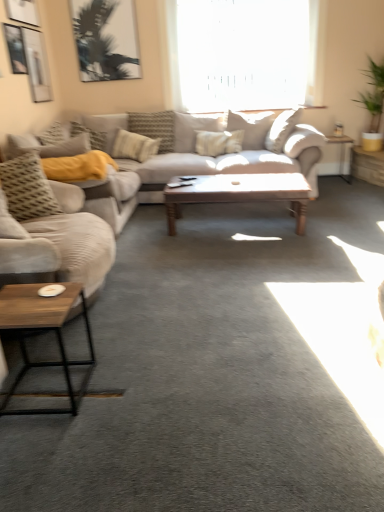
Measure the distance between transparent glass window at upper center and camera.

They are 5.26 meters apart.

This screenshot has width=384, height=512. Describe the element at coordinates (37, 65) in the screenshot. I see `metallic silver picture frame at upper left` at that location.

The height and width of the screenshot is (512, 384). Find the location of `beige fabric couch at center, the 1th studio couch when ordered from back to front`. beige fabric couch at center, the 1th studio couch when ordered from back to front is located at coordinates (143, 199).

Measure the distance between point (252, 134) and camera.

They are 5.05 meters apart.

The width and height of the screenshot is (384, 512). Identify the location of beige fabric couch at left, the 1th studio couch positioned from the front. (50, 230).

Locate an element on the screen. This screenshot has height=512, width=384. transparent glass window at upper center is located at coordinates (242, 53).

From the image's perspective, is beige fabric couch at left, which ranks as the second studio couch in back-to-front order, under textured beige pillow at center, which is the 1th pillow in right-to-left order?

Yes.

Are beige fabric couch at left, which ranks as the second studio couch in back-to-front order, and textured beige pillow at center, positioned as the 2th pillow in back-to-front order, making contact?

They are not placed beside each other.

Is point (30, 237) closer to viewer compared to point (234, 126)?

Yes, it is.

How many degrees apart are the facing directions of wooden side table at right, which is the 1th table from right to left, and beige fabric couch at center, the 1th studio couch when ordered from back to front?

There is a 65.1-degree angle between the facing directions of wooden side table at right, which is the 1th table from right to left, and beige fabric couch at center, the 1th studio couch when ordered from back to front.

The height and width of the screenshot is (512, 384). I want to click on the 1st studio couch directly above the wooden side table at right, which appears as the second table when viewed from the left (from a real-world perspective), so click(x=143, y=199).

Who is more distant, wooden side table at right, which is the 1th table from right to left, or beige fabric couch at center, the 1th studio couch when ordered from back to front?

wooden side table at right, which is the 1th table from right to left, is further from the camera.

Would you consider wooden side table at right, which is the 1th table from right to left, to be distant from beige fabric couch at center, the 1th studio couch when ordered from back to front?

Yes, wooden side table at right, which is the 1th table from right to left, and beige fabric couch at center, the 1th studio couch when ordered from back to front, are quite far apart.

From the image's perspective, starting from the textured beige pillow at center, the third pillow in the left-to-right sequence, which pillow is the 1st one below? Please provide its 2D coordinates.

[(54, 134)]

Considering the relative sizes of textured gray pillow at left, arranged as the fifth pillow when viewed from the right, and textured beige pillow at center, which is the 3th pillow in right-to-left order, in the image provided, is textured gray pillow at left, arranged as the fifth pillow when viewed from the right, wider than textured beige pillow at center, which is the 3th pillow in right-to-left order,?

No.

Which is in front, textured gray pillow at left, acting as the fourth pillow starting from the back, or textured beige pillow at center, which is the 3th pillow in right-to-left order?

textured gray pillow at left, acting as the fourth pillow starting from the back, is more forward.

Looking at this image, in the image, is textured gray pillow at left, acting as the fourth pillow starting from the back, on the left side or the right side of textured beige pillow at center, the 3th pillow in the back-to-front sequence?

textured gray pillow at left, acting as the fourth pillow starting from the back, is positioned on textured beige pillow at center, the 3th pillow in the back-to-front sequence,'s left side.

From the image's perspective, who appears lower, textured gray pillow at left, which is the second pillow in front-to-back order, or metallic silver picture frame at upper left?

From the image's view, textured gray pillow at left, which is the second pillow in front-to-back order, is below.

Is textured gray pillow at left, arranged as the fifth pillow when viewed from the right, spatially inside metallic silver picture frame at upper left, or outside of it?

textured gray pillow at left, arranged as the fifth pillow when viewed from the right, exists outside the volume of metallic silver picture frame at upper left.

Considering the relative sizes of textured gray pillow at left, the 1th pillow positioned from the left, and metallic silver picture frame at upper left in the image provided, is textured gray pillow at left, the 1th pillow positioned from the left, smaller than metallic silver picture frame at upper left?

No, textured gray pillow at left, the 1th pillow positioned from the left, is not smaller than metallic silver picture frame at upper left.

Between beige fabric couch at left, which ranks as the second studio couch in back-to-front order, and textured beige pillow at center, which is the second pillow from right to left, which one has more height?

beige fabric couch at left, which ranks as the second studio couch in back-to-front order.

Is beige fabric couch at left, which ranks as the second studio couch in back-to-front order, looking in the opposite direction of textured beige pillow at center, which is counted as the 5th pillow, starting from the front?

That's not correct — beige fabric couch at left, which ranks as the second studio couch in back-to-front order, is not looking away from textured beige pillow at center, which is counted as the 5th pillow, starting from the front.

From the image's perspective, would you say beige fabric couch at left, which ranks as the second studio couch in back-to-front order, is shown under textured beige pillow at center, the fourth pillow positioned from the left?

Yes.

From the image's perspective, count 4th pillows upward from the beige fabric couch at left, the 1th studio couch positioned from the front, and point to it. Please provide its 2D coordinates.

[(154, 127)]

Identify the location of pillow that is the 5th one when counting backward from the wooden/metallic coffee table at lower left, which is the 1th coffee table in bottom-to-top order. Image resolution: width=384 pixels, height=512 pixels. (154, 127).

Is textured beige pillow at center, which is the second pillow from right to left, completely or partially outside of wooden/metallic coffee table at lower left, which is the 1th coffee table in bottom-to-top order?

textured beige pillow at center, which is the second pillow from right to left, is positioned outside wooden/metallic coffee table at lower left, which is the 1th coffee table in bottom-to-top order.

Does textured beige pillow at center, which is the second pillow from right to left, have a greater height compared to wooden/metallic coffee table at lower left, the first coffee table viewed from the front?

Yes.

From the image's perspective, is textured beige pillow at center, which appears as the first pillow when viewed from the back, located above wooden/metallic coffee table at lower left, which appears as the 2th coffee table when viewed from the top?

Yes, from the image's perspective, textured beige pillow at center, which appears as the first pillow when viewed from the back, is above wooden/metallic coffee table at lower left, which appears as the 2th coffee table when viewed from the top.

Can you confirm if textured gray pillow at left, the 2th pillow positioned from the left, is smaller than wooden polished coffee table at center, which is the second coffee table from left to right?

Yes.

From a real-world perspective, between textured gray pillow at left, the 4th pillow when ordered from right to left, and wooden polished coffee table at center, which is the second coffee table in bottom-to-top order, who is vertically lower?

wooden polished coffee table at center, which is the second coffee table in bottom-to-top order, is physically lower.

Which pillow is the 3rd one when counting from the left side of the wooden polished coffee table at center, the 1th coffee table from the right? Please provide its 2D coordinates.

[(27, 188)]

Which pillow is the 3rd one when counting from the right side of the beige fabric couch at left, the 1th studio couch positioned from the front? Please provide its 2D coordinates.

[(251, 127)]

From the image's perspective, starting from the beige fabric couch at center, the 2th studio couch viewed from the front, which table is the 1st one above? Please provide its 2D coordinates.

[(367, 165)]

Estimate the real-world distances between objects in this image. Which object is closer to beige fabric couch at left, the 1th studio couch positioned from the front, transparent glass window at upper center or metallic silver side table at right, the first table viewed from the left?

Based on the image, metallic silver side table at right, the first table viewed from the left, appears to be nearer to beige fabric couch at left, the 1th studio couch positioned from the front.

Considering their positions, is textured beige pillow at center, positioned as the 2th pillow in back-to-front order, positioned closer to textured gray pillow at left, which is the second pillow in front-to-back order, than metallic silver side table at right, marked as the 2th table in a right-to-left arrangement?

Based on the image, textured beige pillow at center, positioned as the 2th pillow in back-to-front order, appears to be nearer to textured gray pillow at left, which is the second pillow in front-to-back order.

Looking at this image, from the image, which object appears to be farther from metallic silver side table at right, the first table viewed from the left, wooden polished coffee table at center, the second coffee table viewed from the front, or textured beige pillow at center, positioned as the 2th pillow in back-to-front order?

wooden polished coffee table at center, the second coffee table viewed from the front.

Looking at this image, based on their spatial positions, is textured beige pillow at center, which is the 3th pillow in right-to-left order, or textured gray pillow at left, the 1th pillow positioned from the left, further from wooden polished coffee table at center, which is the second coffee table from left to right?

textured gray pillow at left, the 1th pillow positioned from the left, is positioned further to the anchor wooden polished coffee table at center, which is the second coffee table from left to right.

Based on their spatial positions, is textured beige pillow at center, arranged as the fifth pillow when viewed from the left, or metallic silver side table at right, marked as the 2th table in a right-to-left arrangement, closer to textured gray pillow at left, the 4th pillow when ordered from right to left?

textured beige pillow at center, arranged as the fifth pillow when viewed from the left.

Based on their spatial positions, is transparent glass window at upper center or beige fabric couch at left, which ranks as the second studio couch in back-to-front order, closer to metallic silver picture frame at upper left?

Among the two, transparent glass window at upper center is located nearer to metallic silver picture frame at upper left.

Which object lies nearer to the anchor point metallic silver picture frame at upper left, wooden/metallic coffee table at lower left, the second coffee table viewed from the right, or green leafy plant in yellow pot at upper right?

Based on the image, wooden/metallic coffee table at lower left, the second coffee table viewed from the right, appears to be nearer to metallic silver picture frame at upper left.

Based on their spatial positions, is textured gray pillow at left, which is the second pillow in front-to-back order, or wooden/metallic coffee table at lower left, which is the 1th coffee table in bottom-to-top order, further from textured beige pillow at center, arranged as the fourth pillow when viewed from the front?

Among the two, wooden/metallic coffee table at lower left, which is the 1th coffee table in bottom-to-top order, is located further to textured beige pillow at center, arranged as the fourth pillow when viewed from the front.

You are a GUI agent. You are given a task and a screenshot of the screen. Output one action in this format:
    pyautogui.click(x=<x>, y=<y>)
    Task: Click on the pillow between textured beige pillow at center, which is counted as the 5th pillow, starting from the front, and wooden side table at right, which appears as the second table when viewed from the left, from left to right
    The height and width of the screenshot is (512, 384).
    Given the screenshot: What is the action you would take?
    pyautogui.click(x=251, y=127)

Find the location of a particular element. This screenshot has width=384, height=512. window between textured beige pillow at center, which is the 3th pillow in right-to-left order, and wooden side table at right, which is the 1th table from right to left, from left to right is located at coordinates (242, 53).

Locate an element on the screen. The image size is (384, 512). coffee table between beige fabric couch at center, the 1th studio couch when ordered from back to front, and green leafy plant in yellow pot at upper right, in the horizontal direction is located at coordinates (240, 193).

What are the coordinates of `coffee table between wooden/metallic coffee table at lower left, the first coffee table viewed from the front, and transparent glass window at upper center from front to back` in the screenshot? It's located at (240, 193).